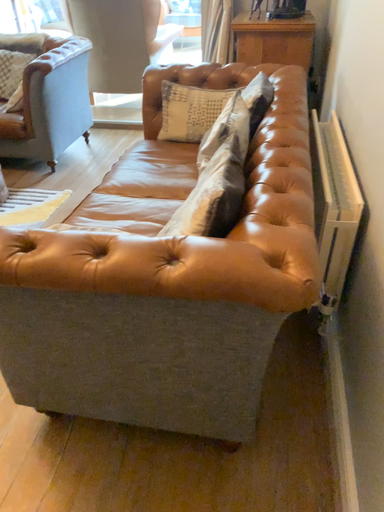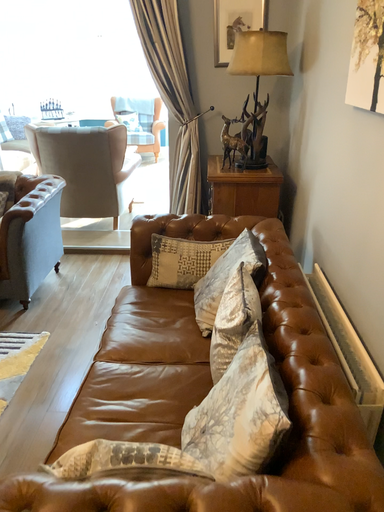
Question: Which way did the camera rotate in the video?

Choices:
 (A) rotated upward
 (B) rotated downward

Answer: (A)